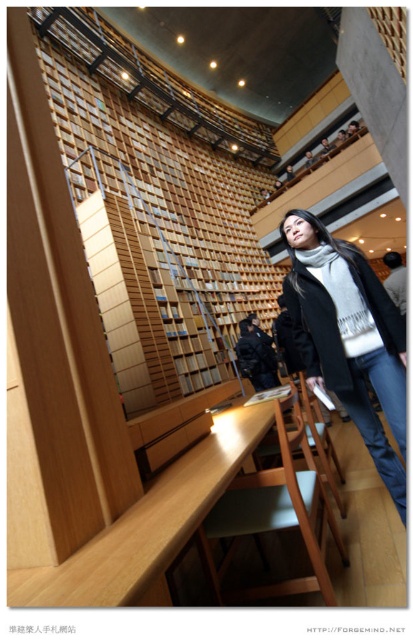
Question: Where is light brown wood table at lower center located in relation to dark gray sweater at center in the image?

Choices:
 (A) left
 (B) right

Answer: (A)

Question: Among these objects, which one is farthest from the camera?

Choices:
 (A) wooden chair at center
 (B) light brown wood table at lower center
 (C) dark blue jacket at center
 (D) dark gray sweater at center

Answer: (C)

Question: Is dark blue jacket at center positioned at the back of matte black jacket at upper center?

Choices:
 (A) no
 (B) yes

Answer: (A)

Question: Does wooden chair at center appear under dark gray sweater at center?

Choices:
 (A) no
 (B) yes

Answer: (B)

Question: Which point is farther to the camera?

Choices:
 (A) dark blue jacket at center
 (B) light brown wood table at lower center
 (C) dark gray sweater at center

Answer: (A)

Question: Which point is farther to the camera?

Choices:
 (A) (203, 544)
 (B) (289, 179)

Answer: (B)